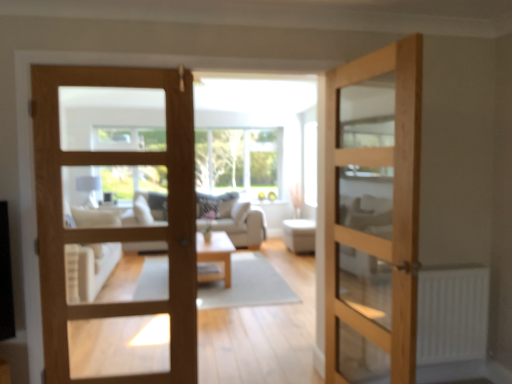
You are a GUI agent. You are given a task and a screenshot of the screen. Output one action in this format:
    pyautogui.click(x=<x>, y=<y>)
    Task: Click on the vacant point above light brown wooden door at center, the 1th door in the left-to-right sequence (from a real-world perspective)
    
    Given the screenshot: What is the action you would take?
    pyautogui.click(x=115, y=65)